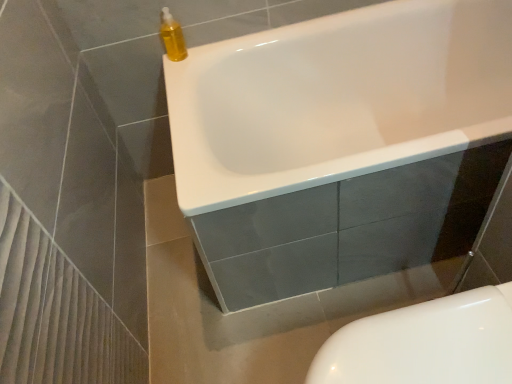
What are the coordinates of `white glossy toilet at lower right` in the screenshot? It's located at (425, 343).

Find the location of a particular element. The width and height of the screenshot is (512, 384). white glossy bathtub at upper center is located at coordinates (337, 99).

Would you consider white glossy bathtub at upper center to be distant from white glossy toilet at lower right?

No, white glossy bathtub at upper center is in close proximity to white glossy toilet at lower right.

Based on the photo, considering the relative sizes of white glossy bathtub at upper center and white glossy toilet at lower right in the image provided, is white glossy bathtub at upper center wider than white glossy toilet at lower right?

Yes, white glossy bathtub at upper center is wider than white glossy toilet at lower right.

From a real-world perspective, which is physically above, white glossy bathtub at upper center or white glossy toilet at lower right?

white glossy bathtub at upper center, from a real-world perspective.

Is white glossy toilet at lower right facing towards white glossy bathtub at upper center?

No, white glossy toilet at lower right is not facing towards white glossy bathtub at upper center.

From the image's perspective, which object appears higher, white glossy toilet at lower right or white glossy bathtub at upper center?

white glossy bathtub at upper center, from the image's perspective.

Is white glossy toilet at lower right bigger than white glossy bathtub at upper center?

No, white glossy toilet at lower right is not bigger than white glossy bathtub at upper center.

Considering the relative positions of white glossy toilet at lower right and white glossy bathtub at upper center in the image provided, is white glossy toilet at lower right to the left of white glossy bathtub at upper center from the viewer's perspective?

Yes, white glossy toilet at lower right is to the left of white glossy bathtub at upper center.

Based on the photo, measure the distance from yellow translucent bottle at upper left to white glossy bathtub at upper center.

yellow translucent bottle at upper left is 21.02 inches away from white glossy bathtub at upper center.

Is yellow translucent bottle at upper left in front of white glossy bathtub at upper center?

No, the depth of yellow translucent bottle at upper left is greater than that of white glossy bathtub at upper center.

Could you tell me if yellow translucent bottle at upper left is turned towards white glossy bathtub at upper center?

No, yellow translucent bottle at upper left is not oriented towards white glossy bathtub at upper center.

Locate an element on the screen. cleaning product on the left of white glossy bathtub at upper center is located at coordinates 172,37.

Can we say white glossy toilet at lower right lies outside yellow translucent bottle at upper left?

Indeed, white glossy toilet at lower right is completely outside yellow translucent bottle at upper left.

Is white glossy toilet at lower right in front of or behind yellow translucent bottle at upper left in the image?

Visually, white glossy toilet at lower right is located in front of yellow translucent bottle at upper left.

Between point (437, 360) and point (165, 12), which one is positioned in front?

Positioned in front is point (437, 360).

From the image's perspective, is white glossy toilet at lower right located above or below yellow translucent bottle at upper left?

Clearly, from the image's perspective, white glossy toilet at lower right is below yellow translucent bottle at upper left.

Identify the location of cleaning product above the white glossy toilet at lower right (from a real-world perspective). The height and width of the screenshot is (384, 512). (172, 37).

From the image's perspective, which object appears higher, yellow translucent bottle at upper left or white glossy toilet at lower right?

yellow translucent bottle at upper left appears higher in the image.

Between point (163, 10) and point (436, 353), which one is positioned in front?

The point (436, 353) is in front.

Can you confirm if white glossy bathtub at upper center is bigger than yellow translucent bottle at upper left?

Correct, white glossy bathtub at upper center is larger in size than yellow translucent bottle at upper left.

Image resolution: width=512 pixels, height=384 pixels. In order to click on bathtub below the yellow translucent bottle at upper left (from a real-world perspective) in this screenshot , I will do `click(337, 99)`.

Considering their positions, is white glossy bathtub at upper center located in front of or behind yellow translucent bottle at upper left?

Visually, white glossy bathtub at upper center is located in front of yellow translucent bottle at upper left.

How distant is white glossy bathtub at upper center from yellow translucent bottle at upper left?

The distance of white glossy bathtub at upper center from yellow translucent bottle at upper left is 21.02 inches.

Find the location of `bathtub located on the right of white glossy toilet at lower right`. bathtub located on the right of white glossy toilet at lower right is located at coordinates (337, 99).

The image size is (512, 384). Find the location of `bathtub behind the white glossy toilet at lower right`. bathtub behind the white glossy toilet at lower right is located at coordinates (337, 99).

Based on their spatial positions, is yellow translucent bottle at upper left or white glossy toilet at lower right further from white glossy bathtub at upper center?

white glossy toilet at lower right lies further to white glossy bathtub at upper center than the other object.

When comparing their distances from yellow translucent bottle at upper left, does white glossy toilet at lower right or white glossy bathtub at upper center seem closer?

white glossy bathtub at upper center is positioned closer to the anchor yellow translucent bottle at upper left.

Consider the image. Considering their positions, is white glossy toilet at lower right positioned further to white glossy bathtub at upper center than yellow translucent bottle at upper left?

white glossy toilet at lower right is positioned further to the anchor white glossy bathtub at upper center.

Based on their spatial positions, is white glossy bathtub at upper center or yellow translucent bottle at upper left closer to white glossy toilet at lower right?

white glossy bathtub at upper center lies closer to white glossy toilet at lower right than the other object.

Which object lies nearer to the anchor point white glossy toilet at lower right, yellow translucent bottle at upper left or white glossy bathtub at upper center?

white glossy bathtub at upper center.

Looking at the image, which one is located closer to yellow translucent bottle at upper left, white glossy bathtub at upper center or white glossy toilet at lower right?

The object closer to yellow translucent bottle at upper left is white glossy bathtub at upper center.

Where is `bathtub between yellow translucent bottle at upper left and white glossy toilet at lower right in the up-down direction`? The height and width of the screenshot is (384, 512). bathtub between yellow translucent bottle at upper left and white glossy toilet at lower right in the up-down direction is located at coordinates (337, 99).